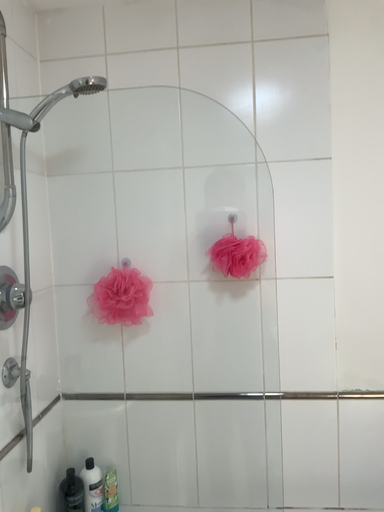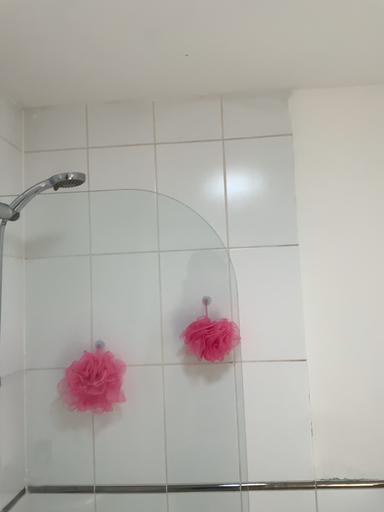
Question: How did the camera likely rotate when shooting the video?

Choices:
 (A) rotated upward
 (B) rotated downward

Answer: (A)